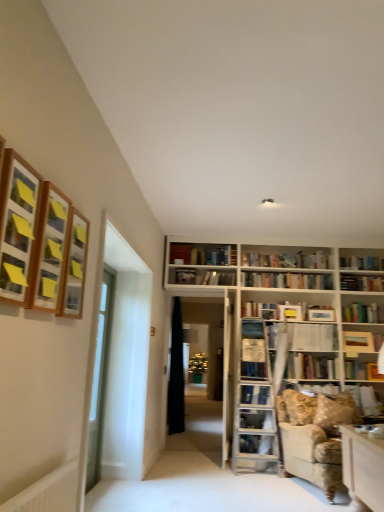
Question: From the image's perspective, is hardcover book at center, positioned as the second book in bottom-to-top order, located above wooden frame at upper left, the second shelf in the front-to-back sequence?

Choices:
 (A) yes
 (B) no

Answer: (B)

Question: Is hardcover book at center, which is the 4th book in back-to-front order, at the right side of wooden frame at upper left, the second shelf in the front-to-back sequence?

Choices:
 (A) yes
 (B) no

Answer: (A)

Question: Does hardcover book at center, positioned as the second book in bottom-to-top order, have a lesser width compared to wooden frame at upper left, which is the 2th shelf from back to front?

Choices:
 (A) yes
 (B) no

Answer: (B)

Question: Is hardcover book at center, which ranks as the 1th book in front-to-back order, taller than wooden frame at upper left, the second shelf in the front-to-back sequence?

Choices:
 (A) yes
 (B) no

Answer: (B)

Question: Can you confirm if hardcover book at center, which is the 4th book in back-to-front order, is shorter than wooden frame at upper left, the second shelf in the front-to-back sequence?

Choices:
 (A) no
 (B) yes

Answer: (B)

Question: Does point (332, 386) appear closer or farther from the camera than point (370, 339)?

Choices:
 (A) closer
 (B) farther

Answer: (A)

Question: From a real-world perspective, is hardcover book at center, the 3th book in the top-to-bottom sequence, above or below wooden bookshelf at upper center, the 4th book from the front?

Choices:
 (A) above
 (B) below

Answer: (B)

Question: Would you say hardcover book at center, positioned as the second book in bottom-to-top order, is to the left or to the right of wooden bookshelf at upper center, the 4th book from the front, in the picture?

Choices:
 (A) left
 (B) right

Answer: (A)

Question: Which is correct: hardcover book at center, the 3th book in the top-to-bottom sequence, is inside wooden bookshelf at upper center, the second book in the top-to-bottom sequence, or outside of it?

Choices:
 (A) inside
 (B) outside

Answer: (B)

Question: Is black fabric curtain at center to the left or to the right of wooden frame at upper left, arranged as the 3th shelf when viewed from the front, in the image?

Choices:
 (A) right
 (B) left

Answer: (A)

Question: Is black fabric curtain at center bigger or smaller than wooden frame at upper left, arranged as the 3th shelf when viewed from the front?

Choices:
 (A) big
 (B) small

Answer: (A)

Question: From a real-world perspective, relative to wooden frame at upper left, arranged as the 3th shelf when viewed from the front, is black fabric curtain at center vertically above or below?

Choices:
 (A) above
 (B) below

Answer: (B)

Question: From the image's perspective, is black fabric curtain at center above or below wooden frame at upper left, the first shelf viewed from the back?

Choices:
 (A) below
 (B) above

Answer: (A)

Question: Considering the positions of wooden framed picture at upper left, acting as the 3th shelf starting from the back, and clear glass door at left, marked as the first glass door in a right-to-left arrangement, in the image, is wooden framed picture at upper left, acting as the 3th shelf starting from the back, bigger or smaller than clear glass door at left, marked as the first glass door in a right-to-left arrangement,?

Choices:
 (A) big
 (B) small

Answer: (B)

Question: Considering the positions of wooden framed picture at upper left, acting as the 3th shelf starting from the back, and clear glass door at left, which ranks as the second glass door in left-to-right order, in the image, is wooden framed picture at upper left, acting as the 3th shelf starting from the back, wider or thinner than clear glass door at left, which ranks as the second glass door in left-to-right order,?

Choices:
 (A) wide
 (B) thin

Answer: (A)